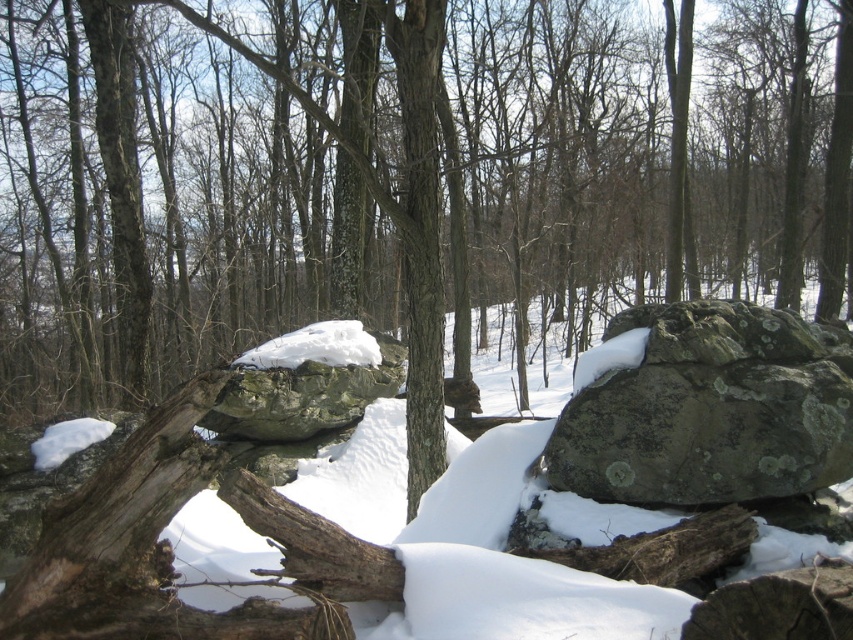
Question: Which of the following is the farthest from the observer?

Choices:
 (A) (583, 429)
 (B) (107, 492)

Answer: (A)

Question: Does white powdery snow at center have a larger size compared to lichen-covered rock at center-right?

Choices:
 (A) no
 (B) yes

Answer: (A)

Question: Can you confirm if white powdery snow at center is positioned below lichen-covered rock at center-right?

Choices:
 (A) no
 (B) yes

Answer: (B)

Question: Is white powdery snow at center thinner than lichen-covered rock at center-right?

Choices:
 (A) yes
 (B) no

Answer: (A)

Question: Which point appears closest to the camera in this image?

Choices:
 (A) (738, 387)
 (B) (683, 403)

Answer: (B)